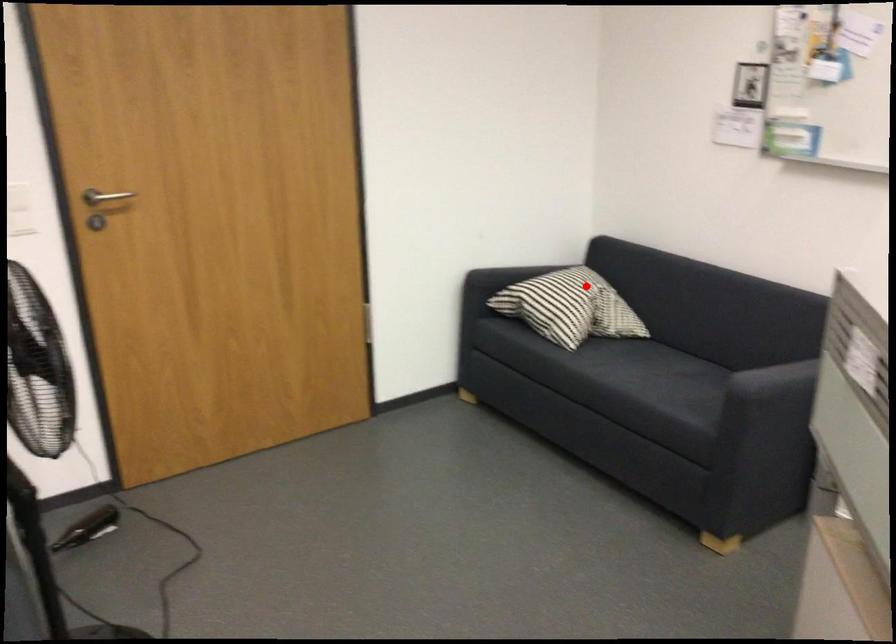
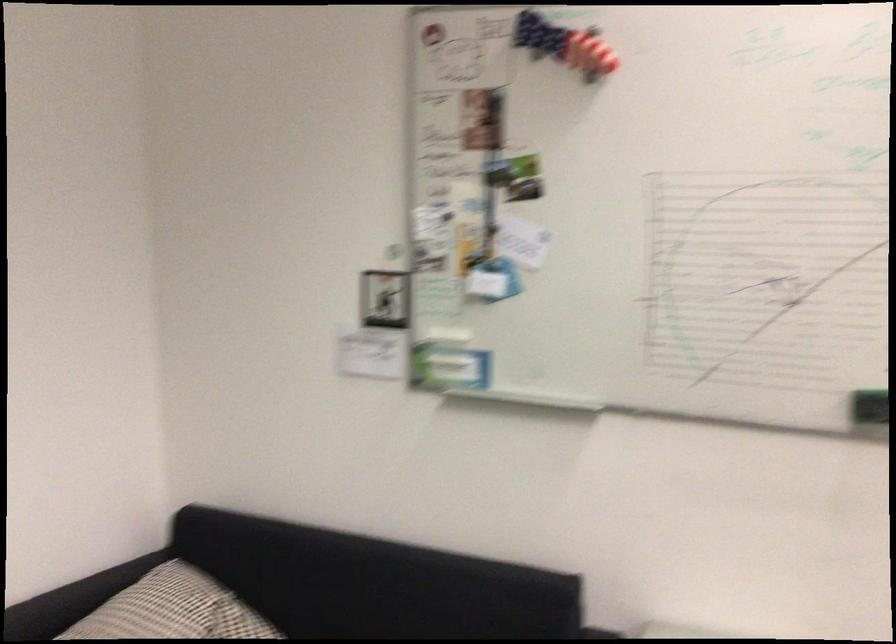
Question: I am providing you with two images of the same scene from different viewpoints. Image1 has a red point marked. In image2, the corresponding 3D location appears at what relative position? Reply with the corresponding letter.

Choices:
 (A) Closer
 (B) Farther

Answer: (A)